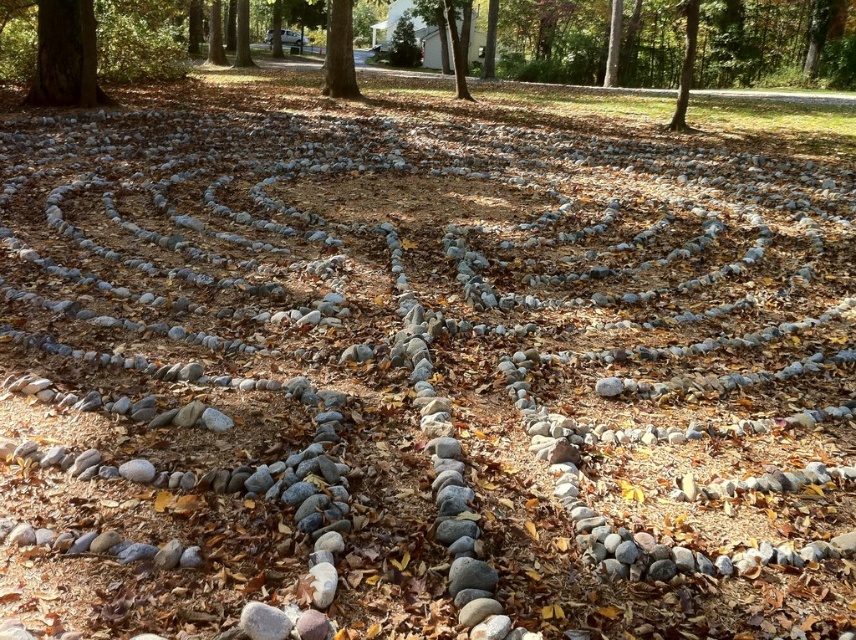
Does point (55, 60) come farther from viewer compared to point (452, 28)?

No.

Who is more distant from viewer, (84, 17) or (450, 26)?

The point (450, 26) is behind.

Does point (63, 1) come behind point (456, 81)?

No, (63, 1) is closer to viewer.

The width and height of the screenshot is (856, 640). I want to click on green rough bark tree at upper left, so click(64, 54).

Can you confirm if green rough bark tree at upper left is wider than green textured tree at upper center?

Incorrect, green rough bark tree at upper left's width does not surpass green textured tree at upper center's.

Image resolution: width=856 pixels, height=640 pixels. I want to click on green rough bark tree at upper left, so click(64, 54).

Find the location of a particular element. The height and width of the screenshot is (640, 856). green rough bark tree at upper left is located at coordinates (64, 54).

The height and width of the screenshot is (640, 856). In order to click on green rough bark tree at upper left in this screenshot , I will do `click(64, 54)`.

Who is taller, green textured tree at upper center or green leafy tree at upper center?

With more height is green leafy tree at upper center.

Is green textured tree at upper center shorter than green leafy tree at upper center?

Yes.

Is point (241, 17) positioned before point (207, 60)?

Yes, it is in front of point (207, 60).

The image size is (856, 640). I want to click on green textured tree at upper center, so click(242, 35).